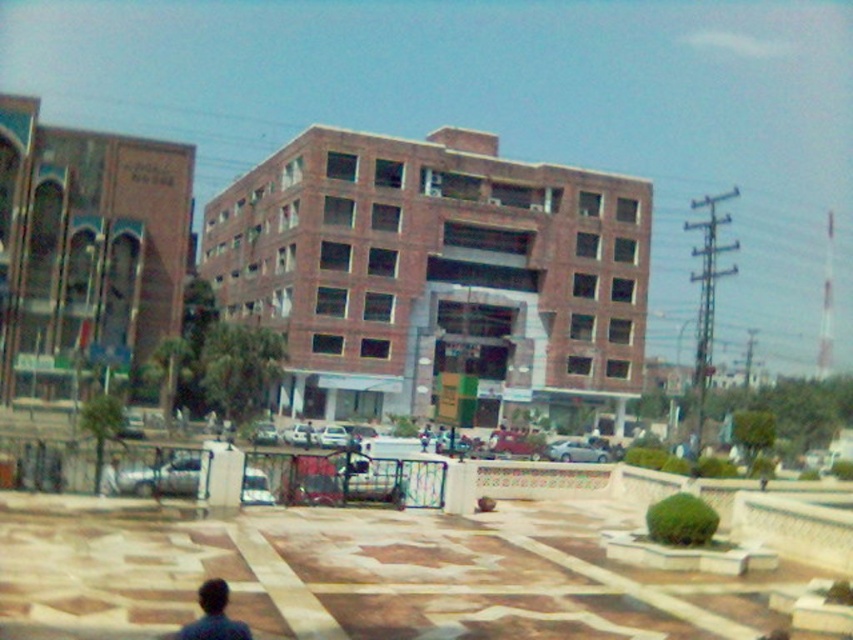
Question: Does brick building at center appear on the left side of dark blue fabric at lower left?

Choices:
 (A) yes
 (B) no

Answer: (A)

Question: Which point is farther to the camera?

Choices:
 (A) dark blue fabric at lower left
 (B) brick building at center

Answer: (B)

Question: Does brick building at center have a greater width compared to dark blue fabric at lower left?

Choices:
 (A) yes
 (B) no

Answer: (A)

Question: Is brick building at center below dark blue fabric at lower left?

Choices:
 (A) no
 (B) yes

Answer: (A)